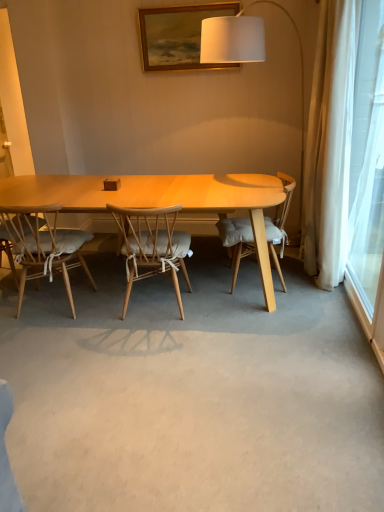
The image size is (384, 512). Identify the location of free spot below light wood chair with white cushion at left, acting as the third chair starting from the right (from a real-world perspective). (56, 304).